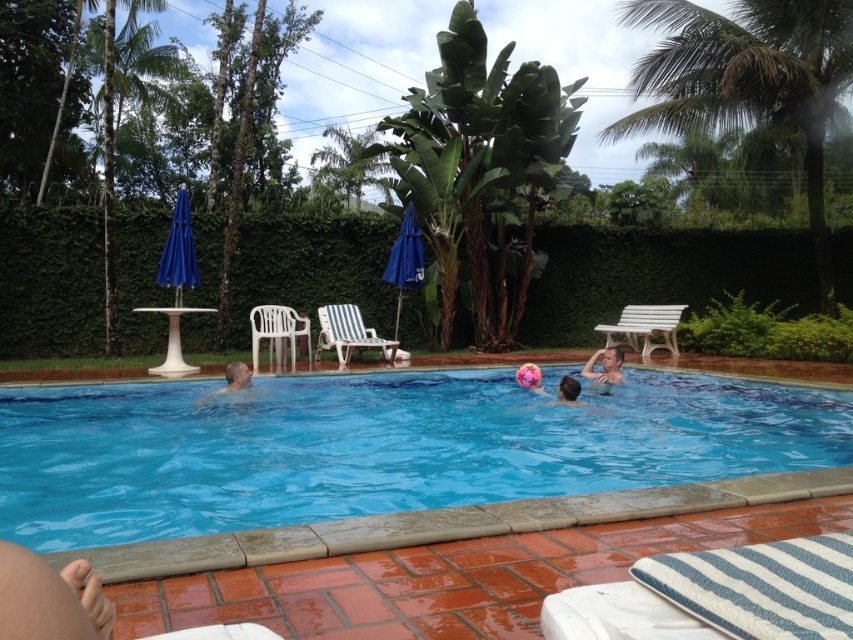
What do you see at coordinates (376, 448) in the screenshot? I see `blue glossy water at center` at bounding box center [376, 448].

I want to click on blue glossy water at center, so click(376, 448).

Can you confirm if white plastic chair at upper left is positioned above smooth pink ball at center?

Yes.

Between white plastic chair at upper left and smooth pink ball at center, which one has less height?

With less height is smooth pink ball at center.

Who is more distant from viewer, (254, 339) or (577, 388)?

Point (254, 339)

Locate an element on the screen. This screenshot has width=853, height=640. white plastic chair at upper left is located at coordinates pyautogui.click(x=277, y=332).

Is white wooden bench at upper right to the left of smooth skin man at center from the viewer's perspective?

Incorrect, white wooden bench at upper right is not on the left side of smooth skin man at center.

Which of these two, white wooden bench at upper right or smooth skin man at center, stands shorter?

smooth skin man at center

What do you see at coordinates (645, 326) in the screenshot? I see `white wooden bench at upper right` at bounding box center [645, 326].

Find the location of a particular element. Image resolution: width=853 pixels, height=640 pixels. white wooden bench at upper right is located at coordinates pyautogui.click(x=645, y=326).